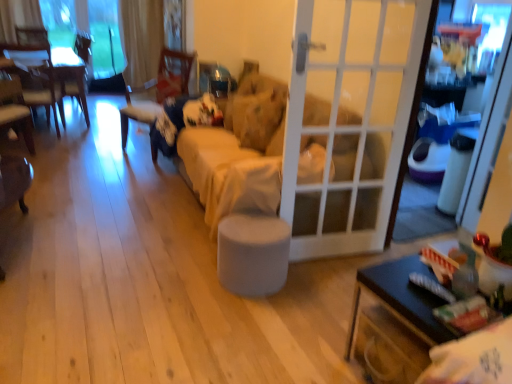
Question: Considering the relative positions of wooden table at left, acting as the first table starting from the back, and white glass door at center in the image provided, is wooden table at left, acting as the first table starting from the back, to the left or to the right of white glass door at center?

Choices:
 (A) right
 (B) left

Answer: (B)

Question: Looking at the image, does wooden table at left, which appears as the 2th table when viewed from the right, seem bigger or smaller compared to white glass door at center?

Choices:
 (A) big
 (B) small

Answer: (A)

Question: Which object is positioned closest to the transparent glass window at upper left?

Choices:
 (A) gray fabric stool at center
 (B) black glossy table at lower right, the 1th table from the bottom
 (C) beige fabric couch at center
 (D) white glass door at center
 (E) wooden table at left, the 2th table positioned from the front

Answer: (E)

Question: Which object is the closest to the velvet dark blue chair at center, the 1th chair positioned from the right?

Choices:
 (A) white glass door at center
 (B) beige fabric couch at center
 (C) wooden chair at left, which is the 2th chair in right-to-left order
 (D) transparent glass window at upper left
 (E) black glossy table at lower right, which is the 2th table in left-to-right order

Answer: (C)